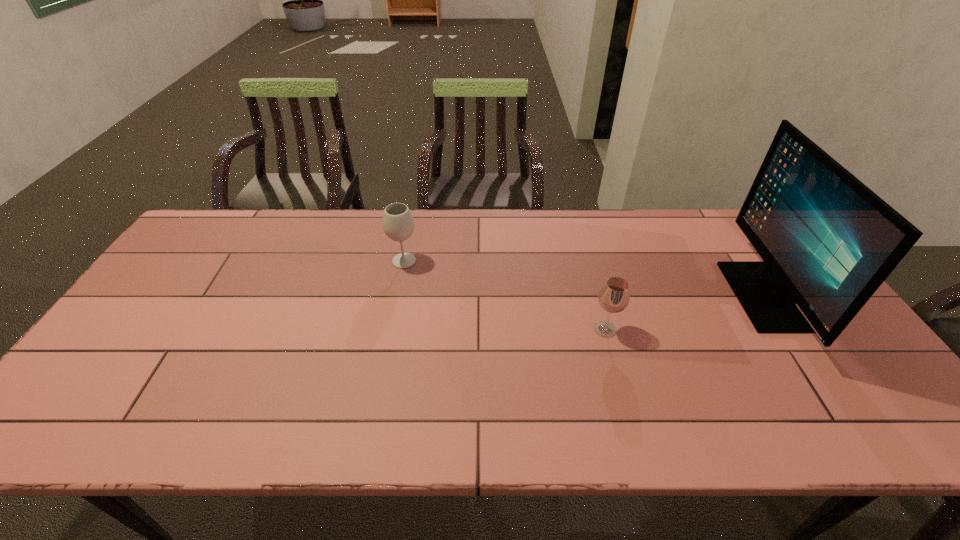
Where is `vacant space at the far right corner`? This screenshot has height=540, width=960. vacant space at the far right corner is located at coordinates (708, 218).

The image size is (960, 540). Find the location of `empty location between the farther wineglass and the tallest object`. empty location between the farther wineglass and the tallest object is located at coordinates (x=585, y=279).

You are a GUI agent. You are given a task and a screenshot of the screen. Output one action in this format:
    pyautogui.click(x=<x>, y=<y>)
    Task: Click on the vacant point located between the leftmost object and the monitor
    
    Given the screenshot: What is the action you would take?
    pyautogui.click(x=585, y=279)

In order to click on free spot between the shortest object and the left wineglass in this screenshot , I will do `click(505, 295)`.

Locate an element on the screen. This screenshot has width=960, height=540. vacant space in between the leftmost object and the right wineglass is located at coordinates (505, 295).

Where is `free space that is in between the leftmost object and the right wineglass`? The height and width of the screenshot is (540, 960). free space that is in between the leftmost object and the right wineglass is located at coordinates click(505, 295).

In order to click on free area in between the tallest object and the shorter wineglass in this screenshot , I will do `click(684, 313)`.

Find the location of a particular element. The height and width of the screenshot is (540, 960). free space between the right wineglass and the farther wineglass is located at coordinates (505, 295).

The width and height of the screenshot is (960, 540). Find the location of `free spot between the shorter wineglass and the left wineglass`. free spot between the shorter wineglass and the left wineglass is located at coordinates (505, 295).

The height and width of the screenshot is (540, 960). I want to click on vacant space that's between the farther wineglass and the tallest object, so click(585, 279).